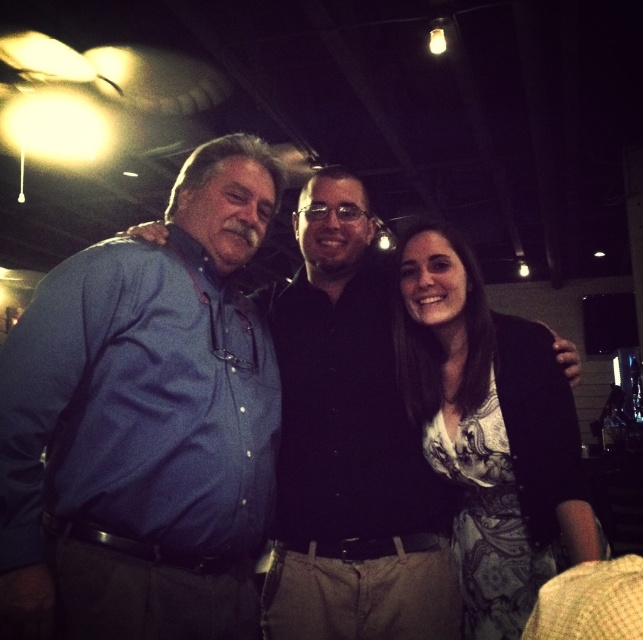
You are taking a photo of two points in the image. The first point is at coordinates point (143, 298) and the second is at point (480, 392). Which point will appear larger in your photo?

Point (143, 298) is closer to the camera than point (480, 392), so it will appear larger in the photo.

You are organizing a photo shoot and need to ensure that the matte blue shirt at center and the patterned fabric dress at center are visible in the frame. Given their sizes, which one might require more space in the composition?

The matte blue shirt at center has a larger size compared to the patterned fabric dress at center, so it would require more space in the composition to ensure visibility.